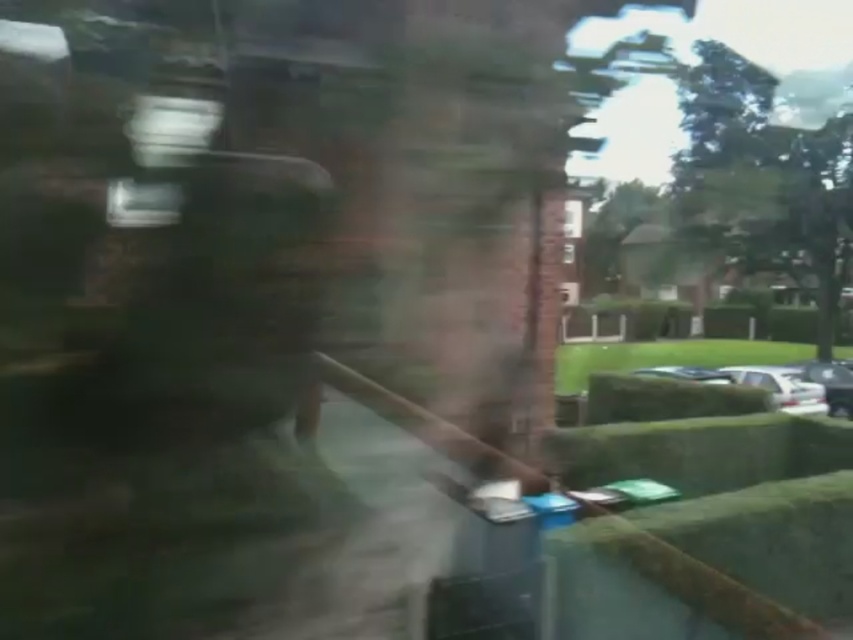
Question: Estimate the real-world distances between objects in this image. Which object is farther from the shiny silver car at center?

Choices:
 (A) white glossy car at lower right
 (B) shiny silver car at lower right

Answer: (B)

Question: Does white glossy car at lower right have a larger size compared to shiny silver car at lower right?

Choices:
 (A) no
 (B) yes

Answer: (A)

Question: Which point is closer to the camera?

Choices:
 (A) (830, 371)
 (B) (636, 369)

Answer: (B)

Question: Which object is positioned closest to the shiny silver car at center?

Choices:
 (A) white glossy car at lower right
 (B) shiny silver car at lower right

Answer: (A)

Question: Can you confirm if white glossy car at lower right is wider than shiny silver car at center?

Choices:
 (A) yes
 (B) no

Answer: (B)

Question: Can you confirm if white glossy car at lower right is positioned below shiny silver car at center?

Choices:
 (A) no
 (B) yes

Answer: (B)